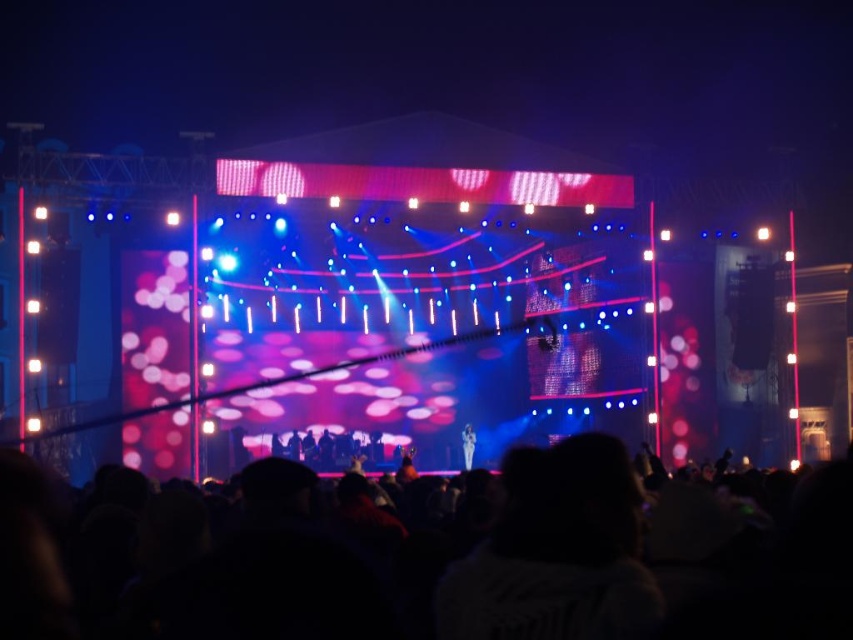
Question: Does black matte crowd at lower center appear on the right side of shiny silver microphone at center?

Choices:
 (A) no
 (B) yes

Answer: (B)

Question: Can you confirm if black matte crowd at lower center is positioned to the left of shiny silver microphone at center?

Choices:
 (A) yes
 (B) no

Answer: (B)

Question: Which of the following is the farthest from the observer?

Choices:
 (A) (465, 465)
 (B) (709, 620)

Answer: (A)

Question: Which point is closer to the camera?

Choices:
 (A) (833, 492)
 (B) (463, 445)

Answer: (A)

Question: Does black matte crowd at lower center appear on the right side of shiny silver microphone at center?

Choices:
 (A) yes
 (B) no

Answer: (A)